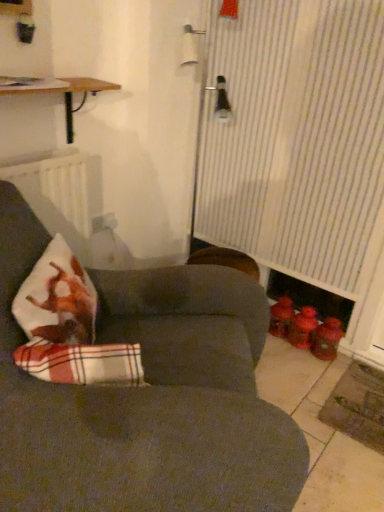
Question: In terms of width, does white striped curtain at right look wider or thinner when compared to plush white pillow with red plaid at left?

Choices:
 (A) thin
 (B) wide

Answer: (A)

Question: Looking at the image, does white striped curtain at right seem bigger or smaller compared to plush white pillow with red plaid at left?

Choices:
 (A) big
 (B) small

Answer: (A)

Question: Estimate the real-world distances between objects in this image. Which object is closer to the plush white pillow with red plaid at left?

Choices:
 (A) wooden shelf at upper left
 (B) plaid fabric cushion at lower left
 (C) white matte radiator at left
 (D) dark gray fabric couch at center
 (E) white striped curtain at right

Answer: (B)

Question: Considering the real-world distances, which object is closest to the dark gray fabric couch at center?

Choices:
 (A) white matte radiator at left
 (B) plush white pillow with red plaid at left
 (C) white striped curtain at right
 (D) plaid fabric cushion at lower left
 (E) wooden shelf at upper left

Answer: (B)